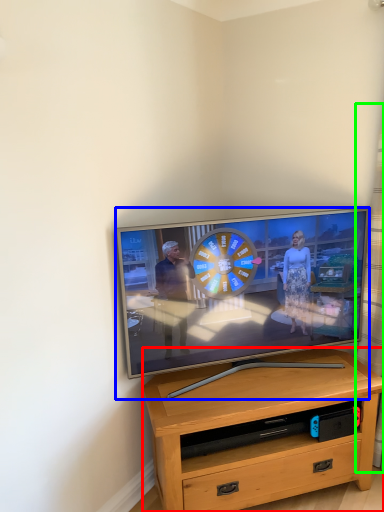
Question: Which is farther away from desk (highlighted by a red box)? television (highlighted by a blue box) or curtain (highlighted by a green box)?

Choices:
 (A) television
 (B) curtain

Answer: (B)